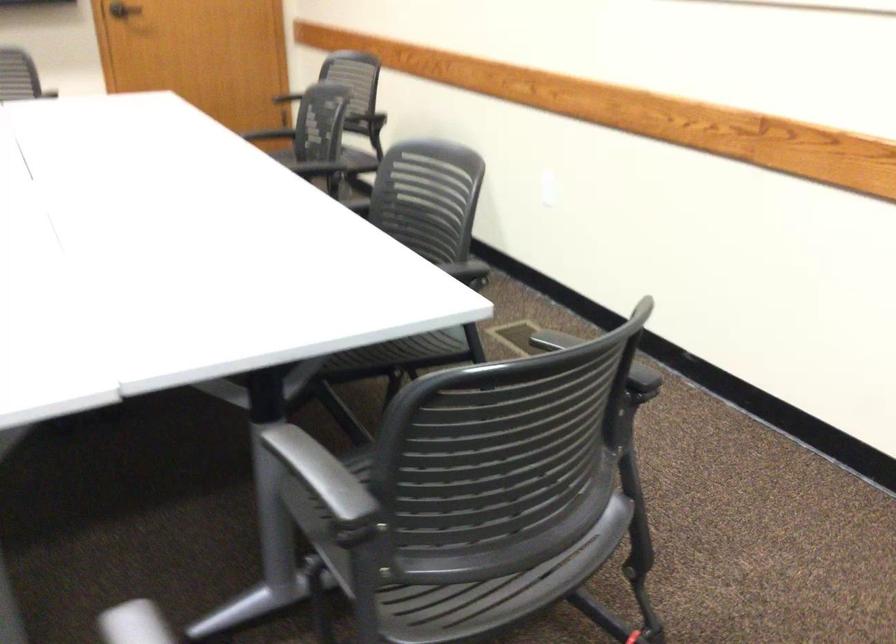
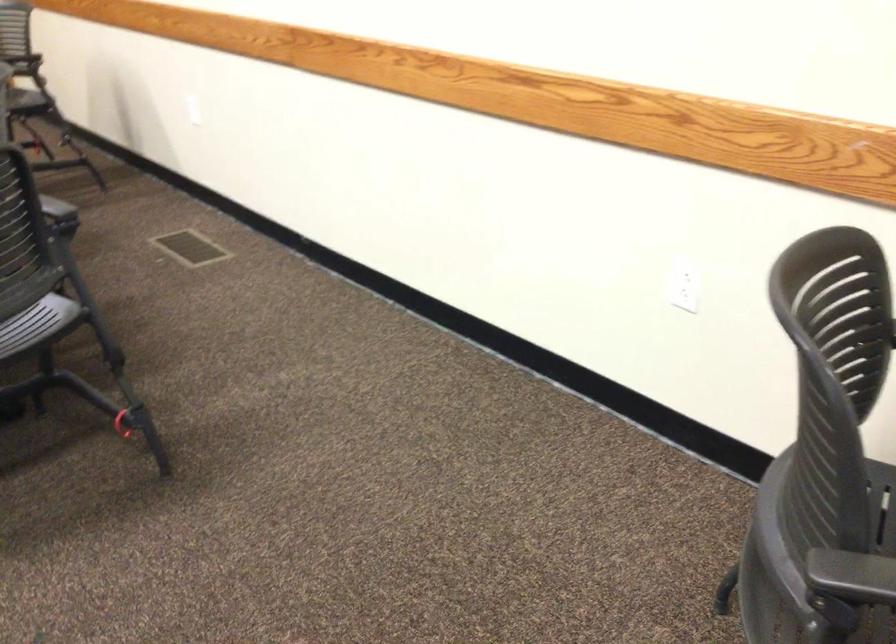
The images are taken continuously from a first-person perspective. In which direction are you moving?

The cameraman walked toward right, backward.